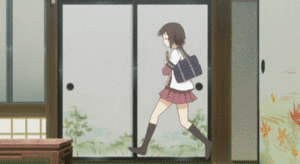
Where is `in the beginning, there is a white door with smaller orange designs on the bottom`? This screenshot has width=300, height=164. in the beginning, there is a white door with smaller orange designs on the bottom is located at coordinates (289, 62).